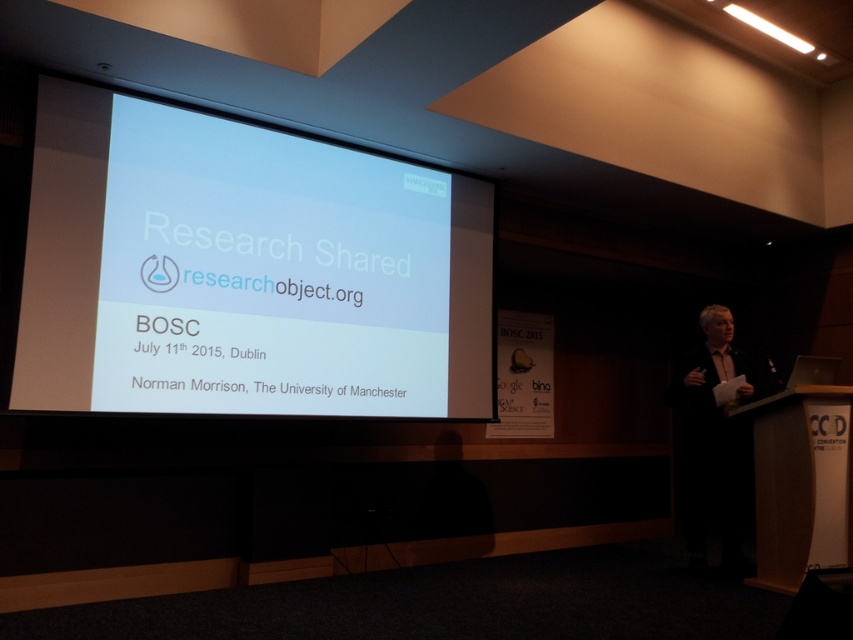
You are an attendee at the conference and you want to take a photo of the slide on the white glossy projection screen at upper left. However, there is a light brown leather jacket at right in the way. Can you take the photo without moving the jacket?

The white glossy projection screen at upper left is in front of the light brown leather jacket at right, so you can take the photo without moving the jacket because the screen is closer to you than the jacket.

You are an attendee in the conference room and want to take a photo of the slide on the white glossy projection screen at upper left without any obstructions. Is the light brown leather jacket at right blocking your view?

The white glossy projection screen at upper left has a larger size compared to light brown leather jacket at right, so the jacket is not large enough to block the entire screen. However, the exact position of the jacket might still partially obstruct the view depending on its placement. Since the jacket is at the right and the screen is at the upper left, there might be some overlap, but the screen is bigger, so most of it should be visible.